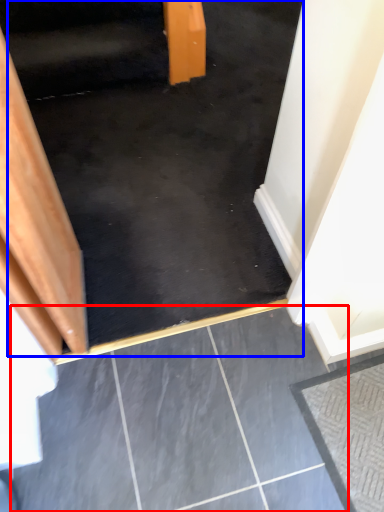
Question: Which point is further to the camera, concrete (highlighted by a red box) or stairs (highlighted by a blue box)?

Choices:
 (A) concrete
 (B) stairs

Answer: (B)